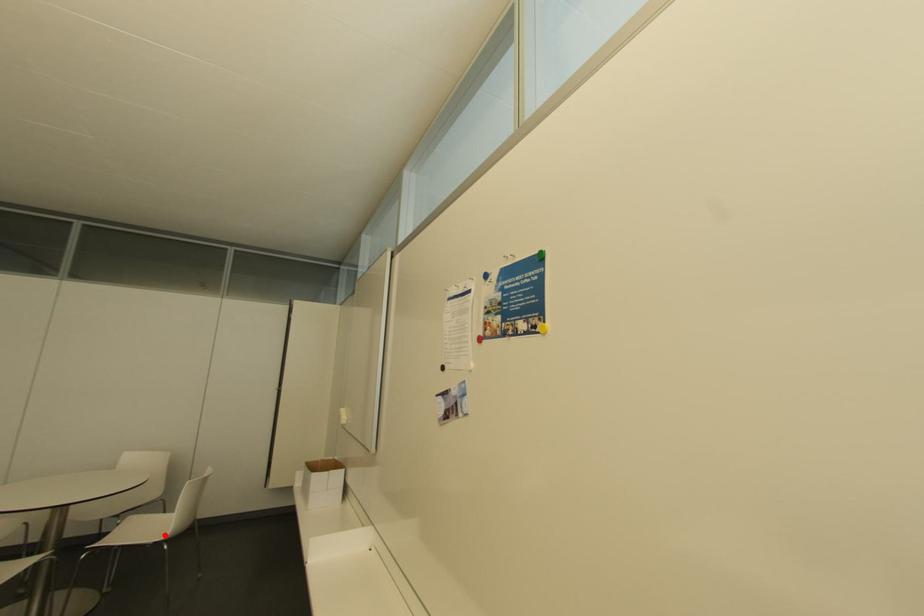
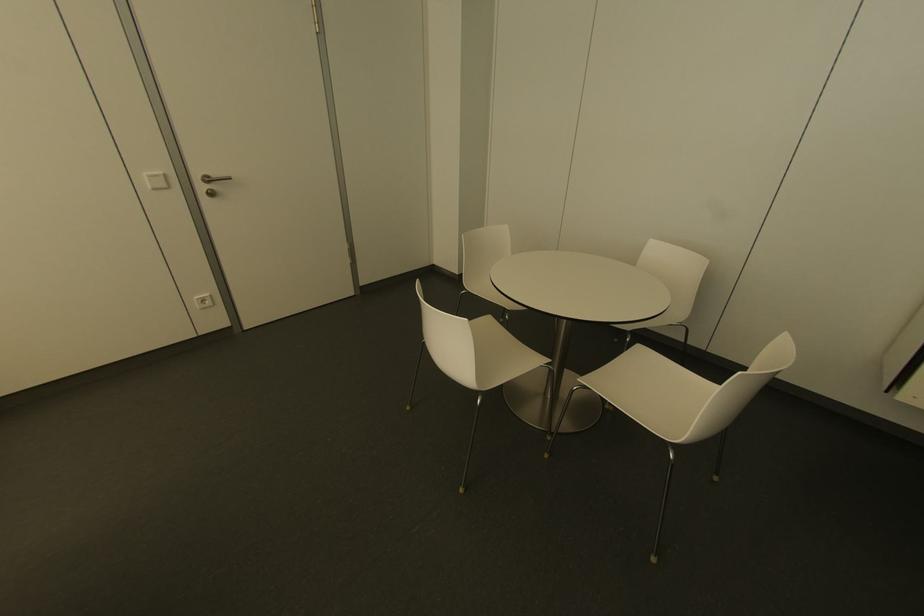
Question: I am providing you with two images of the same scene from different viewpoints. Image1 has a red point marked. In image2, the corresponding 3D location appears at what relative position? Reply with the corresponding letter.

Choices:
 (A) Closer
 (B) Farther

Answer: (B)